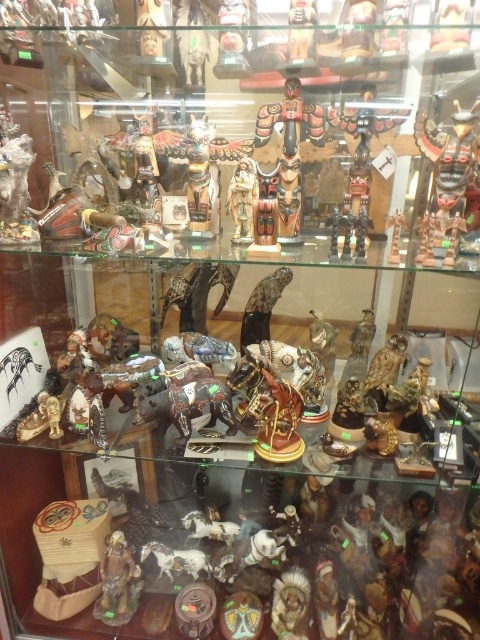
Question: Which point is closer to the camera?

Choices:
 (A) matte brown figurine at lower center
 (B) wooden totem pole at center

Answer: (B)

Question: Which point is closer to the camera?

Choices:
 (A) click(x=243, y=189)
 (B) click(x=139, y=588)
 (C) click(x=302, y=580)
 (D) click(x=311, y=10)

Answer: (D)

Question: Can you confirm if matte brown figurine at lower center is positioned below wooden totem pole at center?

Choices:
 (A) no
 (B) yes

Answer: (B)

Question: Can you confirm if matte brown totem pole at lower left is positioned below matte wooden totem pole at upper center?

Choices:
 (A) yes
 (B) no

Answer: (A)

Question: Is matte wooden totem pole at upper center behind wooden totem pole at center?

Choices:
 (A) yes
 (B) no

Answer: (A)

Question: Which object appears closest to the camera in this image?

Choices:
 (A) matte brown totem pole at lower left
 (B) wooden totem pole at center
 (C) matte wooden totem pole at upper center

Answer: (B)